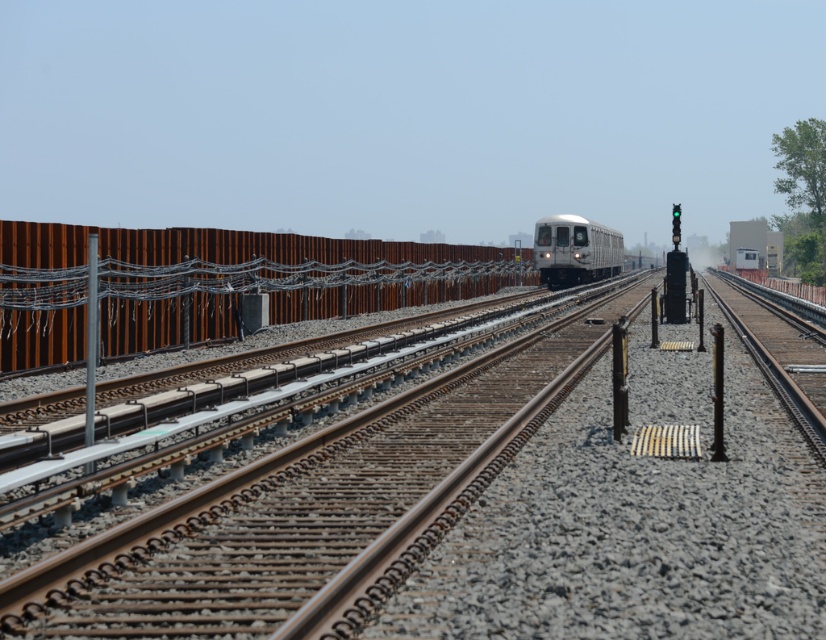
You are standing on the platform observing the brown metal train track at center and the silver metallic train at center. From your perspective, which object is positioned to the left?

The brown metal train track at center is to the left of the silver metallic train at center.

You are standing at point (x=295, y=508) in the railway scene. What is the closest object to you?

The closest object to you at point (x=295, y=508) is the brown metal train track at center, as the point is located on it.